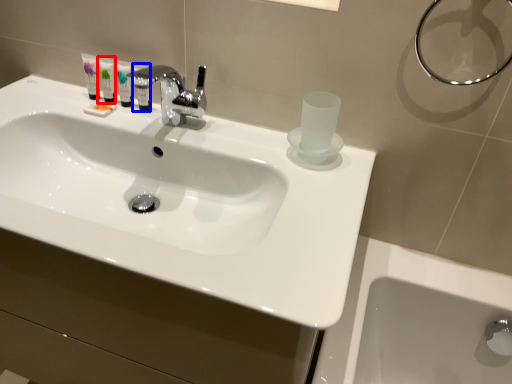
Question: Which point is further to the camera, mouthwash (highlighted by a red box) or mouthwash (highlighted by a blue box)?

Choices:
 (A) mouthwash
 (B) mouthwash

Answer: (A)